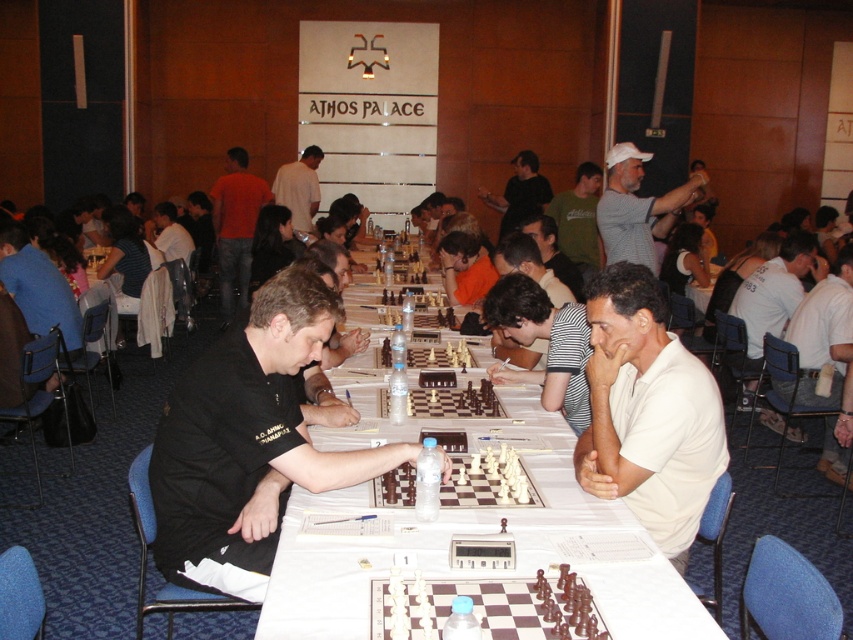
You are a photographer at the chess tournament and need to position your camera to capture both the gray cotton shirt at upper right and the orange shirt at center clearly. Which shirt should you focus on first to ensure both are in focus, considering their sizes?

The gray cotton shirt at upper right is smaller than the orange shirt at center. To ensure both are in focus, you should focus on the orange shirt at center first because it is larger and might require more precise focusing to capture details.

You are a photographer standing at the back of the hall. You want to take a photo of both the white matte shirt at center and the white cotton shirt at right. Which shirt should you adjust to ensure both are fully visible in the photo?

The white matte shirt at center is in front of the white cotton shirt at right. To ensure both are fully visible, you should move the white matte shirt at center slightly backward or the white cotton shirt at right slightly forward so they don not block each other.

Based on the photo, what are the coordinates of the gray cotton shirt at upper right?

The gray cotton shirt at upper right is located at coordinates point (x=636, y=208).